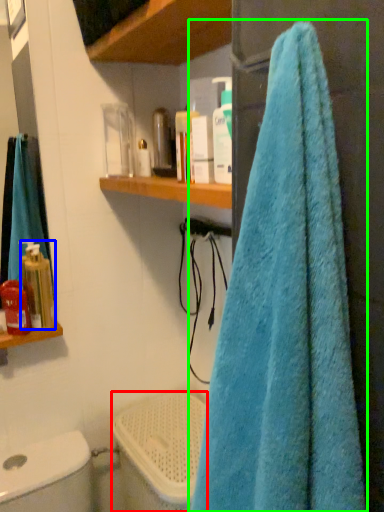
Question: Considering the real-world distances, which object is closest to toilet bowl (highlighted by a red box)? toiletry (highlighted by a blue box) or towel (highlighted by a green box).

Choices:
 (A) toiletry
 (B) towel

Answer: (A)